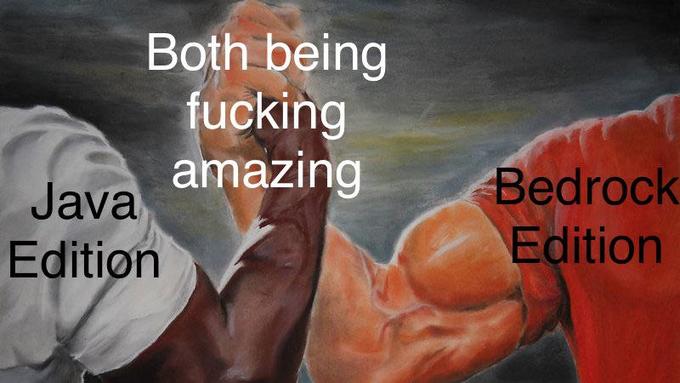
Locate an element on the screen. painting is located at coordinates (436, 115).